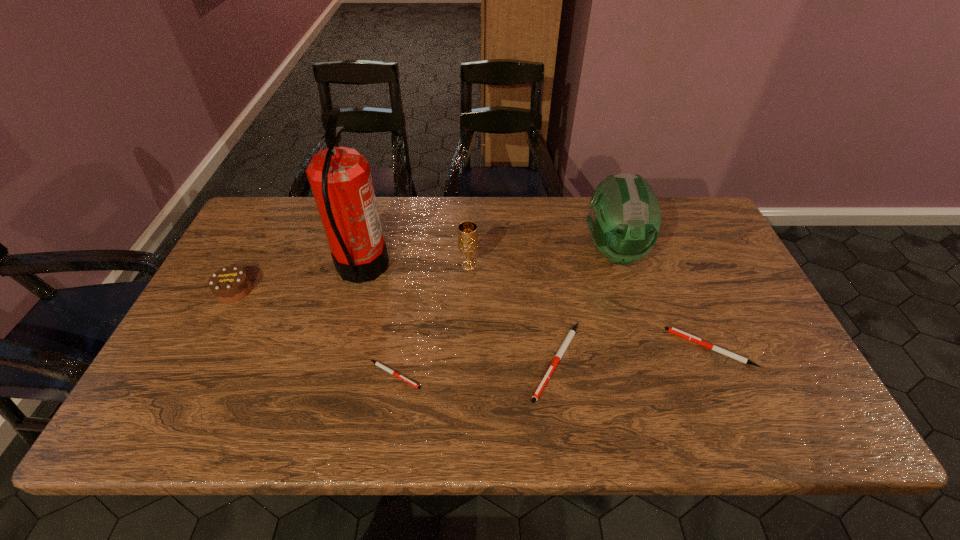
I want to click on chocolate cake, so click(230, 284).

Identify the location of the leftmost object. This screenshot has width=960, height=540. (230, 284).

Locate an element on the screen. vacant space located on the clicker of the shortest object is located at coordinates (482, 375).

At what (x,y) coordinates should I click in order to perform the action: click on vacant space located 0.150m on the clicker of the second tallest pen. Please return your answer as a coordinate pair (x, y). This screenshot has height=540, width=960. Looking at the image, I should click on (610, 348).

Where is `vacant area situated 0.070m on the clicker of the second tallest pen`? vacant area situated 0.070m on the clicker of the second tallest pen is located at coordinates (642, 348).

The image size is (960, 540). Find the location of `free space located 0.150m on the clicker of the second tallest pen`. free space located 0.150m on the clicker of the second tallest pen is located at coordinates (610, 348).

I want to click on free space located 0.160m on the front side of the tallest object, so click(443, 268).

In order to click on free space located on the visor of the football helmet in this screenshot , I will do `click(654, 379)`.

Identify the location of vacant space located 0.070m on the left of the fourth object from right to left. The height and width of the screenshot is (540, 960). (435, 266).

Where is `free region located on the front of the fourth tallest object`? This screenshot has width=960, height=540. free region located on the front of the fourth tallest object is located at coordinates (213, 330).